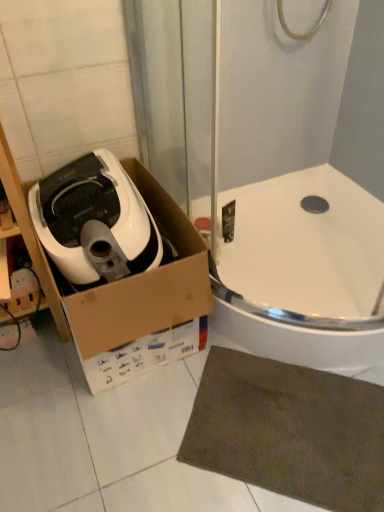
Identify the location of free location to the left of brown textured bath mat at lower right. The height and width of the screenshot is (512, 384). (132, 435).